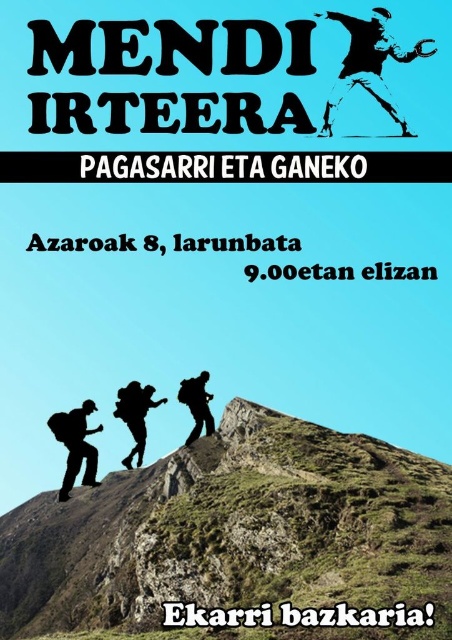
Question: Which point is closer to the camera taking this photo?

Choices:
 (A) (395, 44)
 (B) (65, 488)
 (C) (188, 404)

Answer: (B)

Question: Can you confirm if black silhouette at upper center is bigger than matte black backpack at center?

Choices:
 (A) yes
 (B) no

Answer: (A)

Question: Can you confirm if black matte backpack at lower left is bigger than black matte backpack at center?

Choices:
 (A) yes
 (B) no

Answer: (B)

Question: Which object is positioned farthest from the black silhouette at upper center?

Choices:
 (A) black matte backpack at center
 (B) black matte backpack at lower left
 (C) matte black backpack at center

Answer: (B)

Question: Does green grassy peak at center come in front of black matte backpack at lower left?

Choices:
 (A) no
 (B) yes

Answer: (A)

Question: Which object is positioned farthest from the black silhouette at upper center?

Choices:
 (A) black matte backpack at center
 (B) matte black backpack at center
 (C) black matte backpack at lower left

Answer: (C)